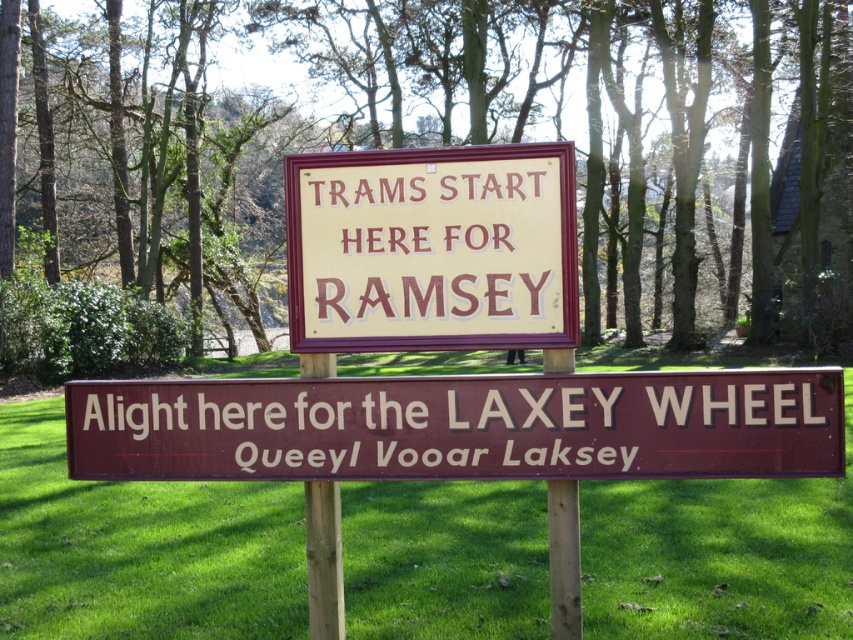
You are a tourist standing in front of two signs on a grassy area. You see the brown wooden sign at center and the yellow painted wood sign at center. Which sign is positioned to the right when facing them?

The brown wooden sign at center is positioned to the right of the yellow painted wood sign at center.

You are standing in the grassy area where the two signs are placed. You want to find the exact location of the green grass at lower center. According to the coordinates provided, where exactly is it located?

The green grass at lower center is located at point (138, 548).